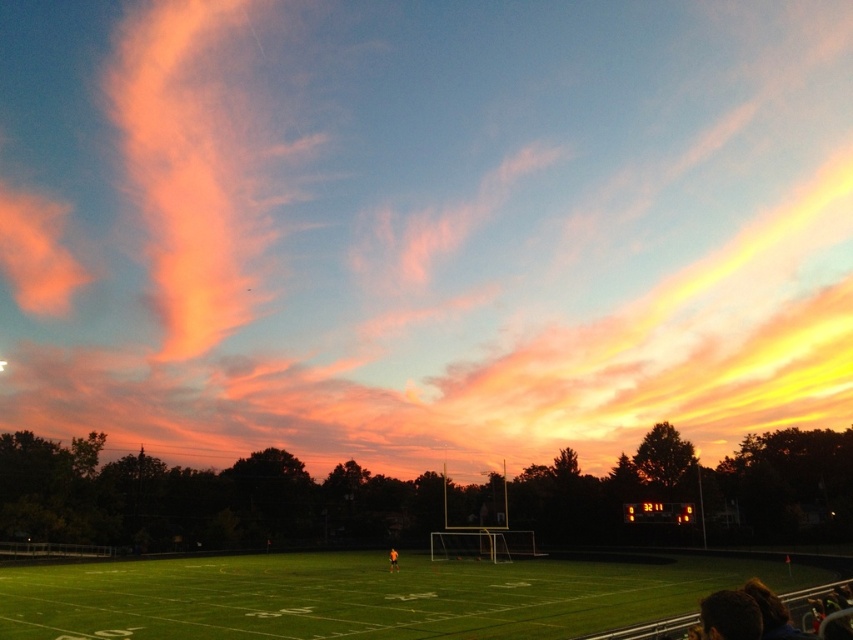
You are an artist painting the evening sky. You have to decide which object to paint first based on their sizes. Which object should you start with, the pink cotton candy cloud at upper center or the green artificial turf at center?

The pink cotton candy cloud at upper center is larger in size than the green artificial turf at center, so you should start with the pink cotton candy cloud at upper center first.

You are a photographer trying to capture the pink cotton candy cloud at upper center in your shot. The camera is positioned at the goalpost near the center of the football field. Based on the coordinates provided, can you determine if the cloud is within the camera frame?

The pink cotton candy cloud at upper center is located at point (424, 225), which falls within the camera frame centered at the goalpost. Therefore, the cloud should be visible in the photograph.